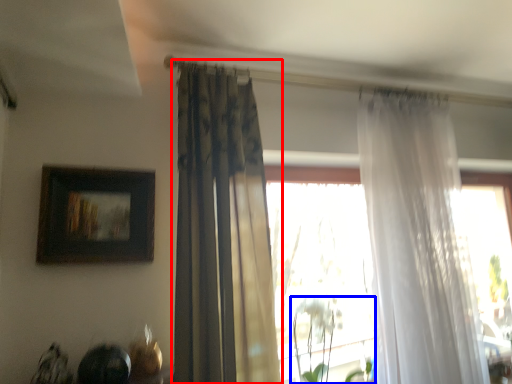
Question: Which point is closer to the camera, curtain (highlighted by a red box) or plant (highlighted by a blue box)?

Choices:
 (A) curtain
 (B) plant

Answer: (A)